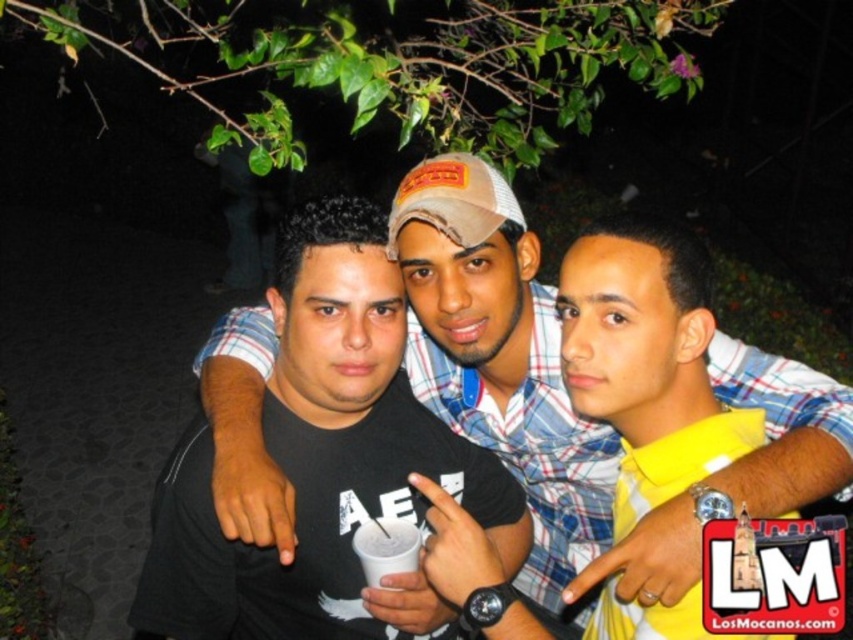
Question: Which object appears closest to the camera in this image?

Choices:
 (A) white matte cup at center
 (B) black matte shirt at center
 (C) black matte t-shirt at center

Answer: (A)

Question: Can you confirm if black matte shirt at center is positioned below black matte t-shirt at center?

Choices:
 (A) yes
 (B) no

Answer: (B)

Question: Can you confirm if black matte t-shirt at center is positioned below white matte cup at center?

Choices:
 (A) no
 (B) yes

Answer: (A)

Question: Among these objects, which one is nearest to the camera?

Choices:
 (A) black matte shirt at center
 (B) white matte cup at center

Answer: (B)

Question: Is black matte t-shirt at center below white matte cup at center?

Choices:
 (A) no
 (B) yes

Answer: (A)

Question: Which object is closer to the camera taking this photo?

Choices:
 (A) black matte t-shirt at center
 (B) black matte shirt at center
 (C) white matte cup at center

Answer: (C)